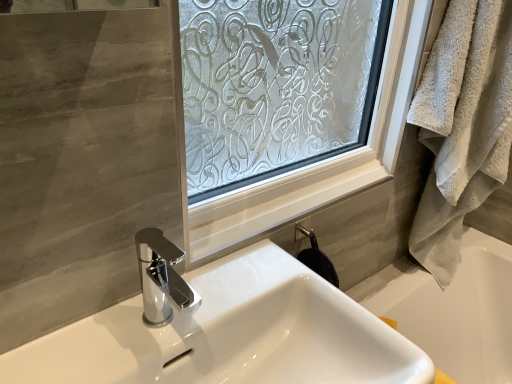
Question: Does white glossy sink at center appear on the right side of white glossy bathtub at lower right?

Choices:
 (A) yes
 (B) no

Answer: (B)

Question: Is white glossy sink at center oriented towards white glossy bathtub at lower right?

Choices:
 (A) no
 (B) yes

Answer: (A)

Question: Is white glossy sink at center thinner than white glossy bathtub at lower right?

Choices:
 (A) no
 (B) yes

Answer: (A)

Question: Considering the relative sizes of white glossy sink at center and white glossy bathtub at lower right in the image provided, is white glossy sink at center bigger than white glossy bathtub at lower right?

Choices:
 (A) no
 (B) yes

Answer: (B)

Question: From the image's perspective, is white glossy sink at center over white glossy bathtub at lower right?

Choices:
 (A) yes
 (B) no

Answer: (A)

Question: Is white glossy sink at center completely or partially outside of white glossy bathtub at lower right?

Choices:
 (A) yes
 (B) no

Answer: (A)

Question: Is beige fluffy towel at right to the right of white glossy sink at center from the viewer's perspective?

Choices:
 (A) yes
 (B) no

Answer: (A)

Question: From a real-world perspective, does beige fluffy towel at right sit lower than white glossy sink at center?

Choices:
 (A) yes
 (B) no

Answer: (B)

Question: Would you say white glossy sink at center is part of beige fluffy towel at right's contents?

Choices:
 (A) yes
 (B) no

Answer: (B)

Question: Does beige fluffy towel at right come in front of white glossy sink at center?

Choices:
 (A) no
 (B) yes

Answer: (A)

Question: Is beige fluffy towel at right turned away from white glossy sink at center?

Choices:
 (A) no
 (B) yes

Answer: (A)

Question: Is beige fluffy towel at right taller than white glossy sink at center?

Choices:
 (A) yes
 (B) no

Answer: (A)

Question: Considering the relative sizes of white glossy bathtub at lower right and beige fluffy towel at right in the image provided, is white glossy bathtub at lower right taller than beige fluffy towel at right?

Choices:
 (A) yes
 (B) no

Answer: (B)